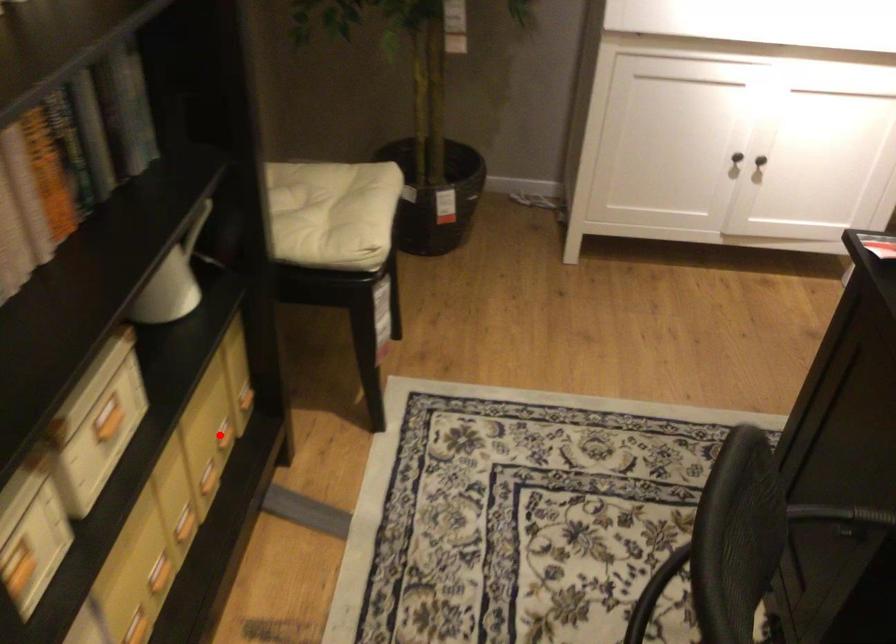
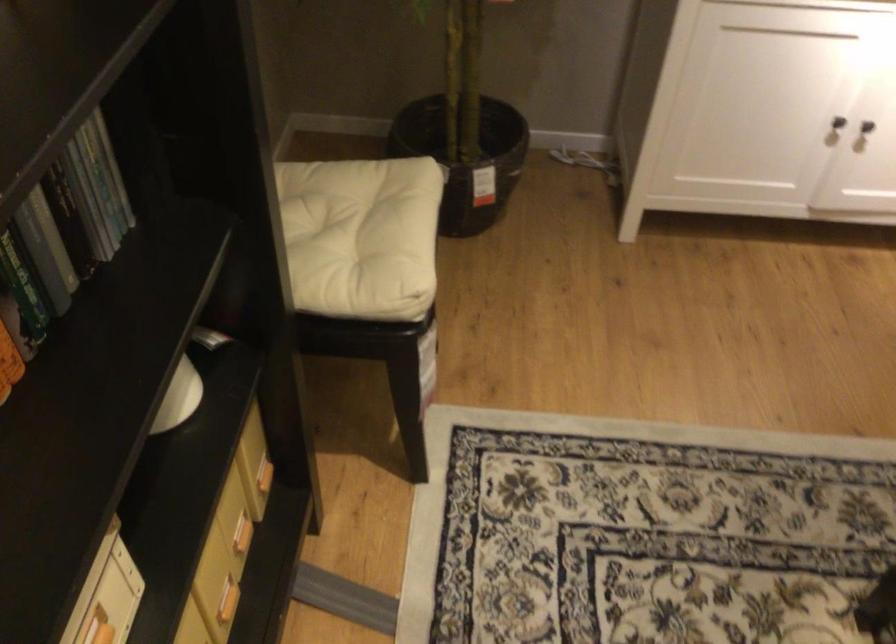
Question: A red point is marked in image1. In image2, is the corresponding 3D point closer to the camera or farther? Reply with the corresponding letter.

Choices:
 (A) The corresponding 3D point is closer.
 (B) The corresponding 3D point is farther.

Answer: (A)